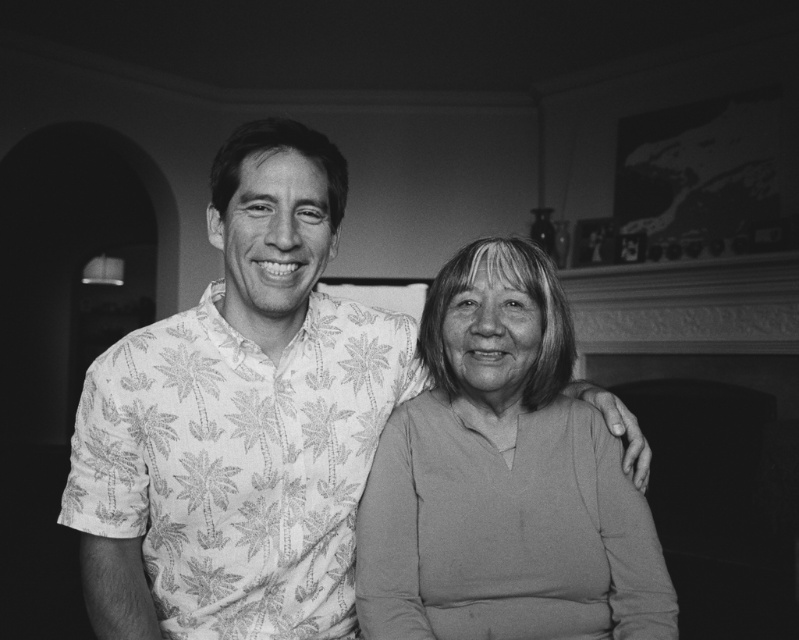
Question: Can you confirm if palm print shirt at left is smaller than smooth cotton sweater at center?

Choices:
 (A) yes
 (B) no

Answer: (B)

Question: Does palm print shirt at left have a greater width compared to smooth cotton sweater at center?

Choices:
 (A) no
 (B) yes

Answer: (B)

Question: Is palm print shirt at left to the left of smooth cotton sweater at center from the viewer's perspective?

Choices:
 (A) no
 (B) yes

Answer: (B)